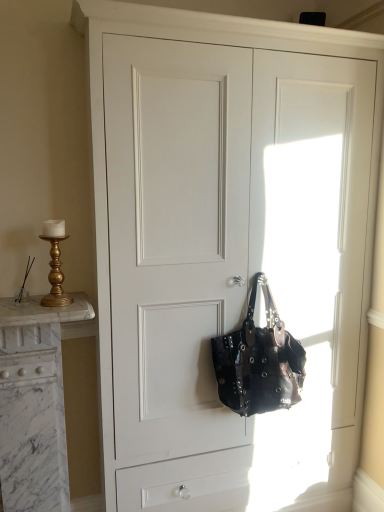
What do you see at coordinates (55, 264) in the screenshot? I see `gold metallic candlestick at left` at bounding box center [55, 264].

Locate an element on the screen. Image resolution: width=384 pixels, height=512 pixels. gold metallic candlestick at left is located at coordinates (55, 264).

The width and height of the screenshot is (384, 512). I want to click on shiny black leather handbag at center, so click(x=259, y=361).

Describe the element at coordinates (259, 361) in the screenshot. The width and height of the screenshot is (384, 512). I see `shiny black leather handbag at center` at that location.

Find the location of a particular element. This screenshot has width=384, height=512. gold metallic candlestick at left is located at coordinates (55, 264).

Would you say shiny black leather handbag at center is to the left or to the right of gold metallic candlestick at left in the picture?

From the image, it's evident that shiny black leather handbag at center is to the right of gold metallic candlestick at left.

Is shiny black leather handbag at center positioned before gold metallic candlestick at left?

No.

Considering the points (276, 386) and (48, 222), which point is behind, point (276, 386) or point (48, 222)?

Positioned behind is point (276, 386).

From the image's perspective, is shiny black leather handbag at center above or below gold metallic candlestick at left?

Clearly, from the image's perspective, shiny black leather handbag at center is below gold metallic candlestick at left.

From a real-world perspective, is shiny black leather handbag at center above or below gold metallic candlestick at left?

In terms of real-world spatial position, shiny black leather handbag at center is below gold metallic candlestick at left.

In terms of width, does shiny black leather handbag at center look wider or thinner when compared to gold metallic candlestick at left?

In the image, shiny black leather handbag at center appears to be wider than gold metallic candlestick at left.

Which of these two, shiny black leather handbag at center or gold metallic candlestick at left, stands taller?

Standing taller between the two is shiny black leather handbag at center.

In terms of size, does shiny black leather handbag at center appear bigger or smaller than gold metallic candlestick at left?

shiny black leather handbag at center is bigger than gold metallic candlestick at left.

Is shiny black leather handbag at center inside the boundaries of gold metallic candlestick at left, or outside?

shiny black leather handbag at center is outside gold metallic candlestick at left.

Is there a large distance between shiny black leather handbag at center and gold metallic candlestick at left?

No, shiny black leather handbag at center is in close proximity to gold metallic candlestick at left.

Is shiny black leather handbag at center oriented away from gold metallic candlestick at left?

No, shiny black leather handbag at center is not facing away from gold metallic candlestick at left.

At what (x,y) coordinates should I click in order to perform the action: click on handbag below the gold metallic candlestick at left (from the image's perspective). Please return your answer as a coordinate pair (x, y). Looking at the image, I should click on (259, 361).

Considering the relative positions of gold metallic candlestick at left and shiny black leather handbag at center in the image provided, is gold metallic candlestick at left to the right of shiny black leather handbag at center from the viewer's perspective?

No.

Between gold metallic candlestick at left and shiny black leather handbag at center, which one is positioned behind?

shiny black leather handbag at center is further away from the camera.

Does point (62, 279) come in front of point (285, 405)?

Yes, point (62, 279) is closer to viewer.

From the image's perspective, is gold metallic candlestick at left over shiny black leather handbag at center?

Yes, from the image's perspective, gold metallic candlestick at left is above shiny black leather handbag at center.

From a real-world perspective, which is physically below, gold metallic candlestick at left or shiny black leather handbag at center?

From a 3D spatial view, shiny black leather handbag at center is below.

Is gold metallic candlestick at left thinner than shiny black leather handbag at center?

Indeed, gold metallic candlestick at left has a lesser width compared to shiny black leather handbag at center.

Considering the sizes of objects gold metallic candlestick at left and shiny black leather handbag at center in the image provided, who is shorter, gold metallic candlestick at left or shiny black leather handbag at center?

Standing shorter between the two is gold metallic candlestick at left.

Based on their sizes in the image, would you say gold metallic candlestick at left is bigger or smaller than shiny black leather handbag at center?

Clearly, gold metallic candlestick at left is smaller in size than shiny black leather handbag at center.

In the scene shown: Which is correct: gold metallic candlestick at left is inside shiny black leather handbag at center, or outside of it?

gold metallic candlestick at left is outside shiny black leather handbag at center.

Is gold metallic candlestick at left far from shiny black leather handbag at center?

gold metallic candlestick at left is near shiny black leather handbag at center, not far away.

Does gold metallic candlestick at left turn towards shiny black leather handbag at center?

No, gold metallic candlestick at left is not aimed at shiny black leather handbag at center.

How many degrees apart are the facing directions of gold metallic candlestick at left and shiny black leather handbag at center?

There is a 0.336-degree angle between the facing directions of gold metallic candlestick at left and shiny black leather handbag at center.

How much distance is there between gold metallic candlestick at left and shiny black leather handbag at center?

80.90 centimeters.

The height and width of the screenshot is (512, 384). I want to click on handbag lying behind the gold metallic candlestick at left, so click(x=259, y=361).

Where is `handbag lying on the right of gold metallic candlestick at left`? The height and width of the screenshot is (512, 384). handbag lying on the right of gold metallic candlestick at left is located at coordinates (259, 361).

You are a GUI agent. You are given a task and a screenshot of the screen. Output one action in this format:
    pyautogui.click(x=<x>, y=<y>)
    Task: Click on the handbag behind the gold metallic candlestick at left
    
    Given the screenshot: What is the action you would take?
    pyautogui.click(x=259, y=361)